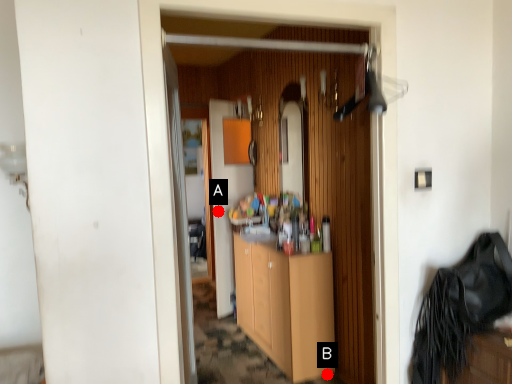
Question: Two points are circled on the image, labeled by A and B beside each circle. Which of the following is the closest to the observer?

Choices:
 (A) A is closer
 (B) B is closer

Answer: (B)